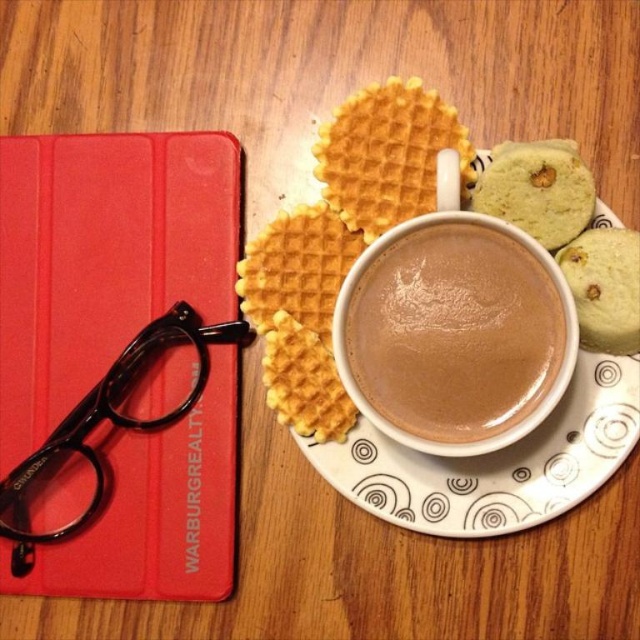
Question: Can you confirm if golden textured waffle at upper center is positioned to the right of green textured cookie at upper right?

Choices:
 (A) no
 (B) yes

Answer: (A)

Question: Is white ceramic saucer at upper center above golden crispy waffle at center?

Choices:
 (A) no
 (B) yes

Answer: (B)

Question: Which object appears closest to the camera in this image?

Choices:
 (A) golden waffle at center
 (B) green textured cookie at upper right
 (C) red matte tablet at left
 (D) green crumbly cookie at right

Answer: (D)

Question: Which object appears closest to the camera in this image?

Choices:
 (A) red matte tablet at left
 (B) golden crispy waffle at center
 (C) green crumbly cookie at right

Answer: (C)

Question: Where is golden textured waffle at upper center located in relation to golden crispy waffle at center in the image?

Choices:
 (A) right
 (B) left

Answer: (A)

Question: Which point is farther from the camera taking this photo?

Choices:
 (A) (269, 362)
 (B) (314, 273)
 (C) (353, 314)
 (D) (620, 424)

Answer: (B)